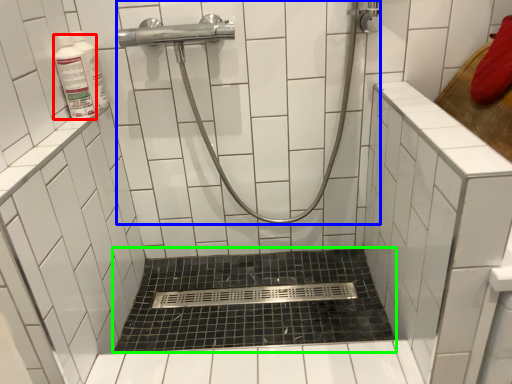
Question: Estimate the real-world distances between objects in this image. Which object is farther from toiletry (highlighted by a red box), shower (highlighted by a blue box) or bath (highlighted by a green box)?

Choices:
 (A) shower
 (B) bath

Answer: (B)